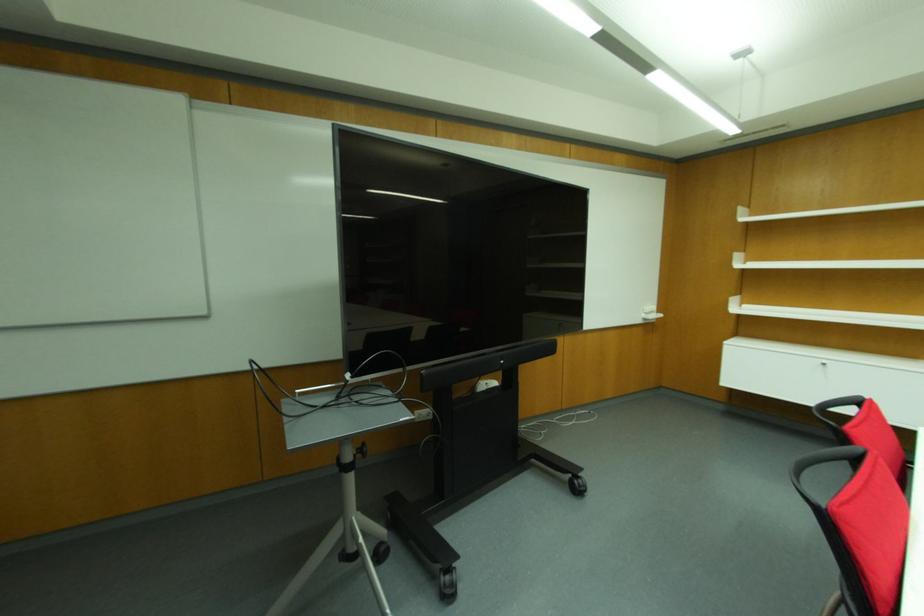
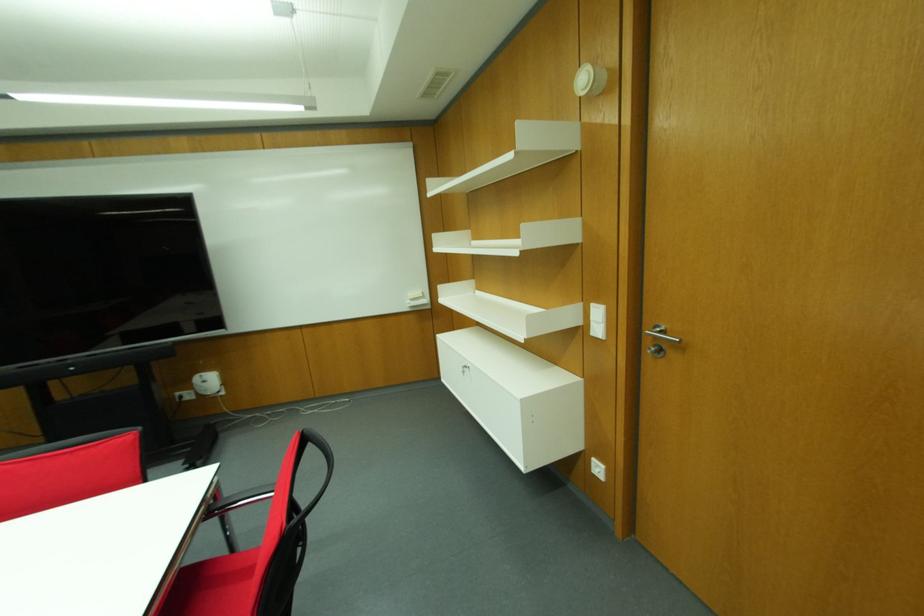
Question: In a continuous first-person perspective shot, in which direction is the camera moving?

Choices:
 (A) Left
 (B) Right
 (C) Forward
 (D) Backward

Answer: (B)